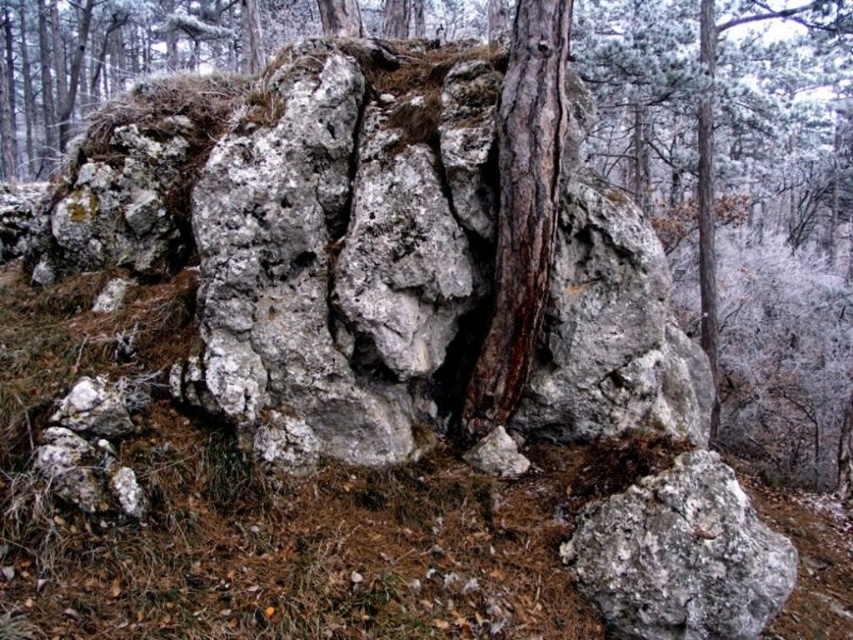
Question: Can you confirm if white lichen-covered rock at center is positioned to the right of brown rough tree trunk at center?

Choices:
 (A) no
 (B) yes

Answer: (A)

Question: Which object is positioned closest to the gray rough rock at center?

Choices:
 (A) brown rough tree trunk at center
 (B) white lichen-covered rock at center

Answer: (A)

Question: Which point is farther to the camera?

Choices:
 (A) (706, 628)
 (B) (433, 376)

Answer: (B)

Question: From the image, what is the correct spatial relationship of gray rough rock at center in relation to brown rough tree trunk at center?

Choices:
 (A) left
 (B) right

Answer: (B)

Question: Which point is farther to the camera?

Choices:
 (A) white lichen-covered rock at center
 (B) gray rough rock at center
 (C) brown rough tree trunk at center

Answer: (C)

Question: Is white lichen-covered rock at center wider than gray rough rock at center?

Choices:
 (A) yes
 (B) no

Answer: (A)